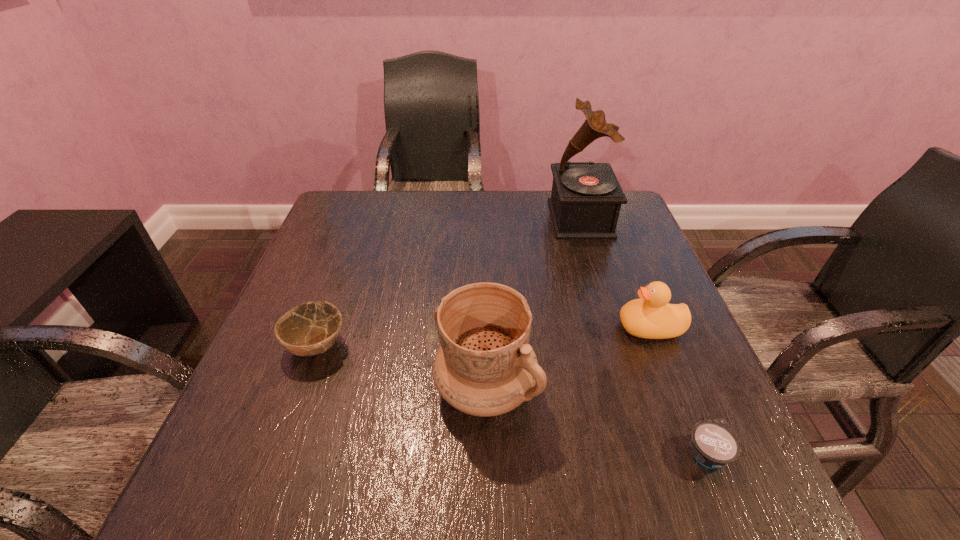
Image resolution: width=960 pixels, height=540 pixels. I want to click on blank space at the near left corner of the desktop, so click(x=243, y=471).

Where is `vacant region at the near right corner of the desktop`? This screenshot has width=960, height=540. vacant region at the near right corner of the desktop is located at coordinates (712, 479).

Find the location of a particular element. This screenshot has height=540, width=960. empty location between the third tallest object and the farthest object is located at coordinates (615, 273).

Locate an element on the screen. The width and height of the screenshot is (960, 540). free space between the tallest object and the third tallest object is located at coordinates (615, 273).

You are a GUI agent. You are given a task and a screenshot of the screen. Output one action in this format:
    pyautogui.click(x=<x>, y=<y>)
    Task: Click on the free space between the shortest object and the duck
    The image size is (960, 540).
    Given the screenshot: What is the action you would take?
    pyautogui.click(x=679, y=390)

Image resolution: width=960 pixels, height=540 pixels. Find the location of `blank region between the third shortest object and the phonograph_record`. blank region between the third shortest object and the phonograph_record is located at coordinates (615, 273).

I want to click on blank region between the shortest object and the duck, so click(x=679, y=390).

The image size is (960, 540). Find the location of `vacant space that is in between the farthest object and the duck`. vacant space that is in between the farthest object and the duck is located at coordinates (615, 273).

Identify the location of vacant region between the shortest object and the fourth shortest object. This screenshot has width=960, height=540. (596, 421).

At what (x,y) coordinates should I click in order to perform the action: click on vacant area between the farthest object and the leftmost object. Please return your answer as a coordinate pair (x, y). Looking at the image, I should click on (448, 282).